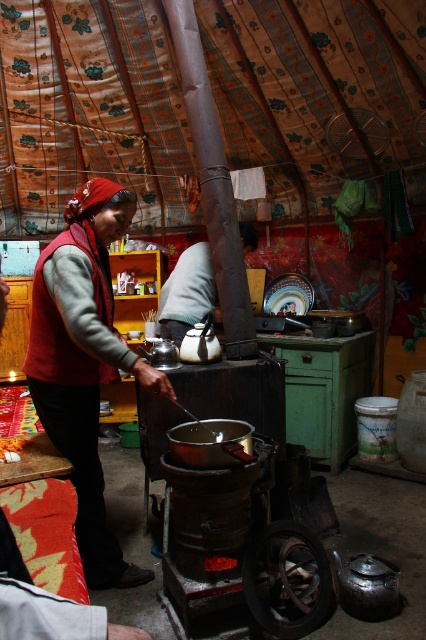
Looking at this image, which of these two, red woolen vest at center or matte black shirt at center, stands taller?

Standing taller between the two is red woolen vest at center.

Does red woolen vest at center appear on the left side of matte black shirt at center?

Yes, red woolen vest at center is to the left of matte black shirt at center.

Is point (77, 378) positioned after point (203, 288)?

That is False.

You are a GUI agent. You are given a task and a screenshot of the screen. Output one action in this format:
    pyautogui.click(x=<x>, y=<y>)
    Task: Click on the red woolen vest at center
    
    Given the screenshot: What is the action you would take?
    pyautogui.click(x=83, y=362)